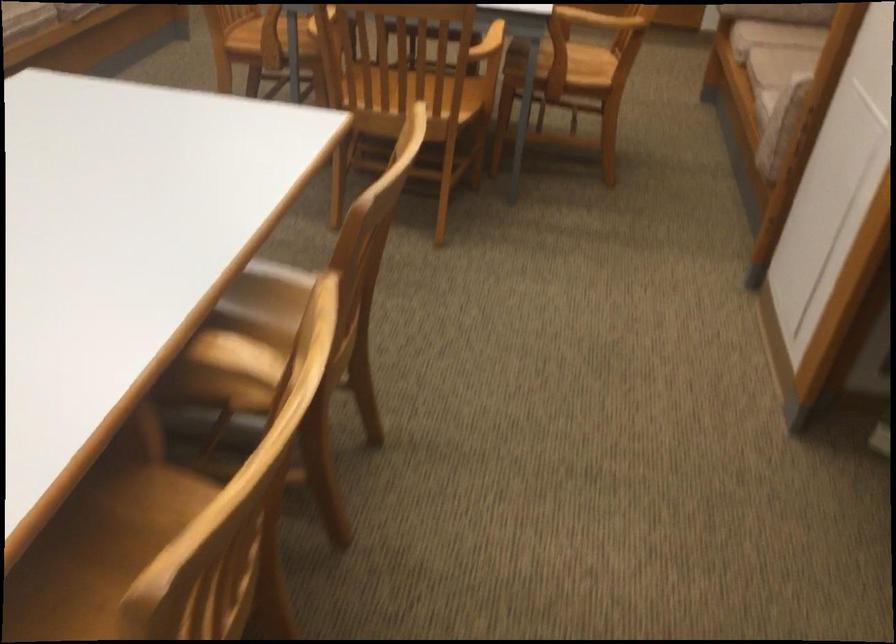
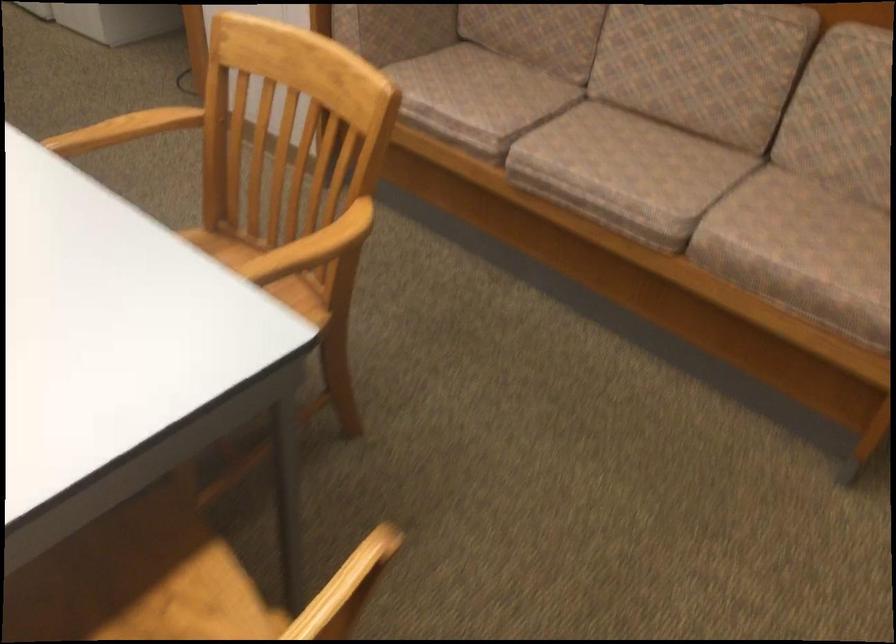
Question: I am providing you with two images of the same scene from different viewpoints. After the viewpoint changes to image2, which objects are now occluded?

Choices:
 (A) sofa sitting surface
 (B) chair sitting surface
 (C) white microwave dial
 (D) wooden chair sitting surface

Answer: (D)